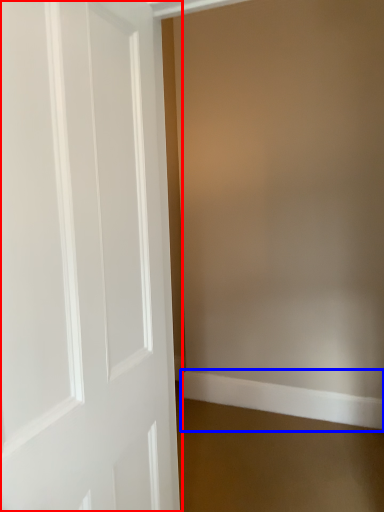
Question: Which point is further to the camera, door (highlighted by a red box) or molding (highlighted by a blue box)?

Choices:
 (A) door
 (B) molding

Answer: (B)